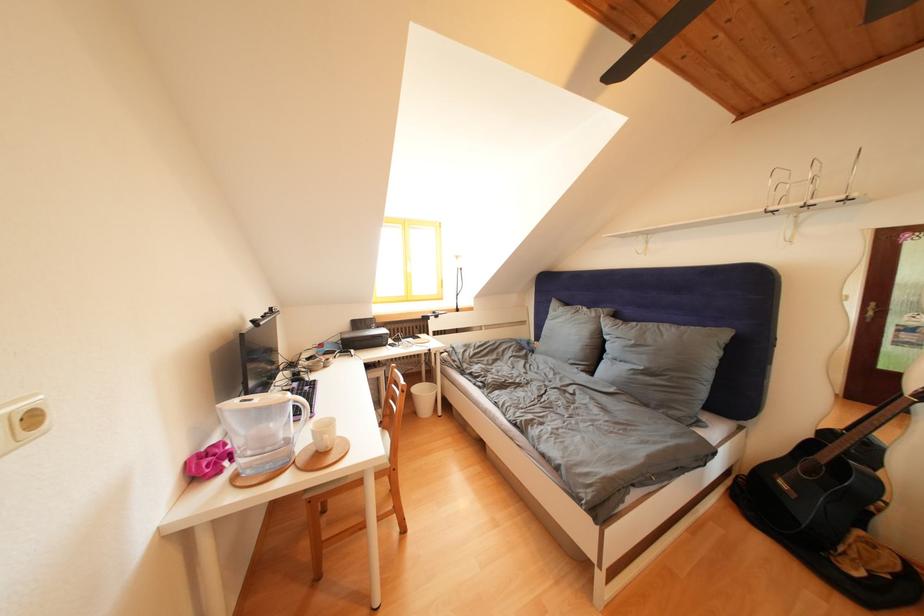
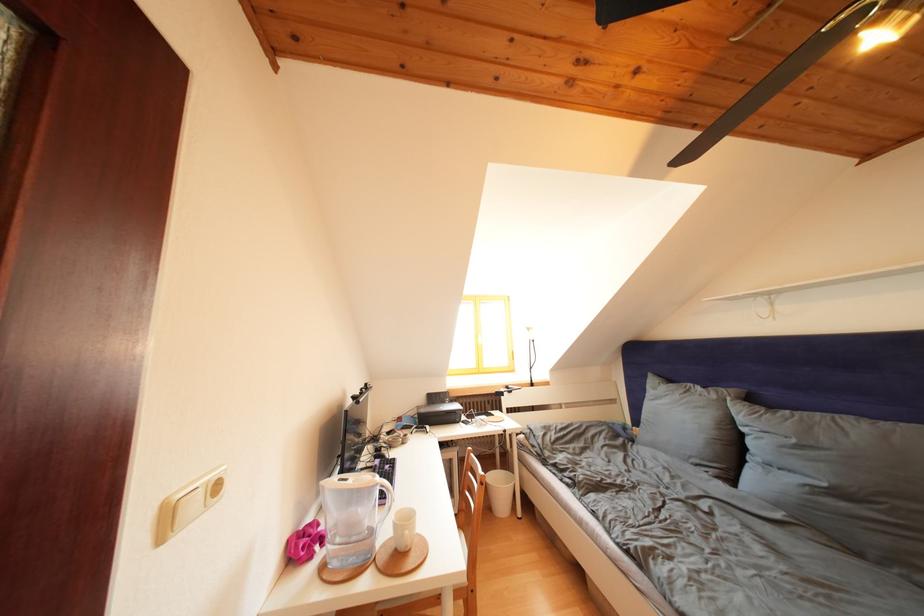
In the second image, find the point that corresponds to [429,387] in the first image.

(503, 472)